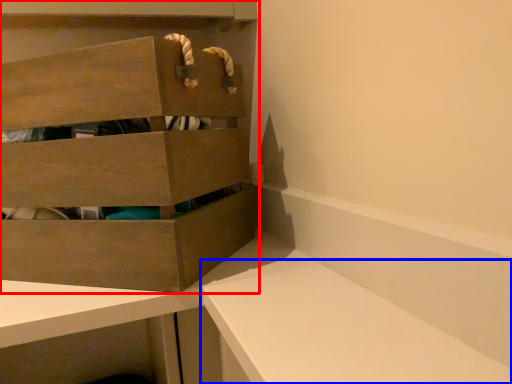
Question: Which of the following is the closest to the observer, cabinetry (highlighted by a red box) or vanity (highlighted by a blue box)?

Choices:
 (A) cabinetry
 (B) vanity

Answer: (B)